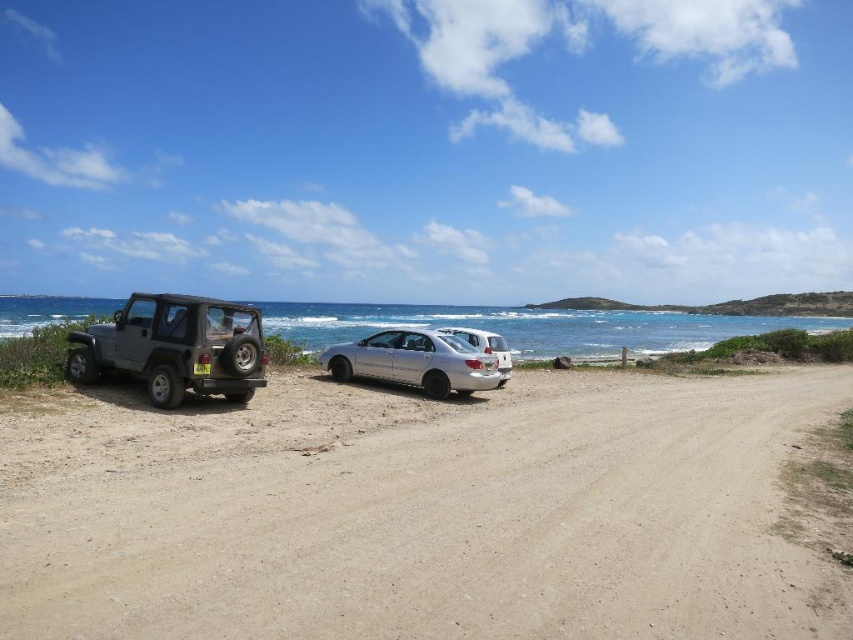
Does matte black jeep at left lie in front of silver metallic sedan at center?

Yes.

Can you confirm if matte black jeep at left is positioned to the left of silver metallic sedan at center?

Correct, you'll find matte black jeep at left to the left of silver metallic sedan at center.

This screenshot has height=640, width=853. In order to click on matte black jeep at left in this screenshot , I will do `click(173, 348)`.

Looking at this image, between dirt track at center and matte black jeep at left, which one appears on the right side from the viewer's perspective?

Positioned to the right is dirt track at center.

Between point (230, 442) and point (227, 376), which one is positioned in front?

Positioned in front is point (230, 442).

You are a GUI agent. You are given a task and a screenshot of the screen. Output one action in this format:
    pyautogui.click(x=<x>, y=<y>)
    Task: Click on the dirt track at center
    This screenshot has height=640, width=853.
    Given the screenshot: What is the action you would take?
    pyautogui.click(x=419, y=513)

Can you confirm if matte black jeep at left is bigger than satin silver sedan at center?

No.

Is matte black jeep at left behind satin silver sedan at center?

No, it is in front of satin silver sedan at center.

Which is behind, point (180, 300) or point (503, 362)?

Point (503, 362)

Image resolution: width=853 pixels, height=640 pixels. Identify the location of matte black jeep at left. (173, 348).